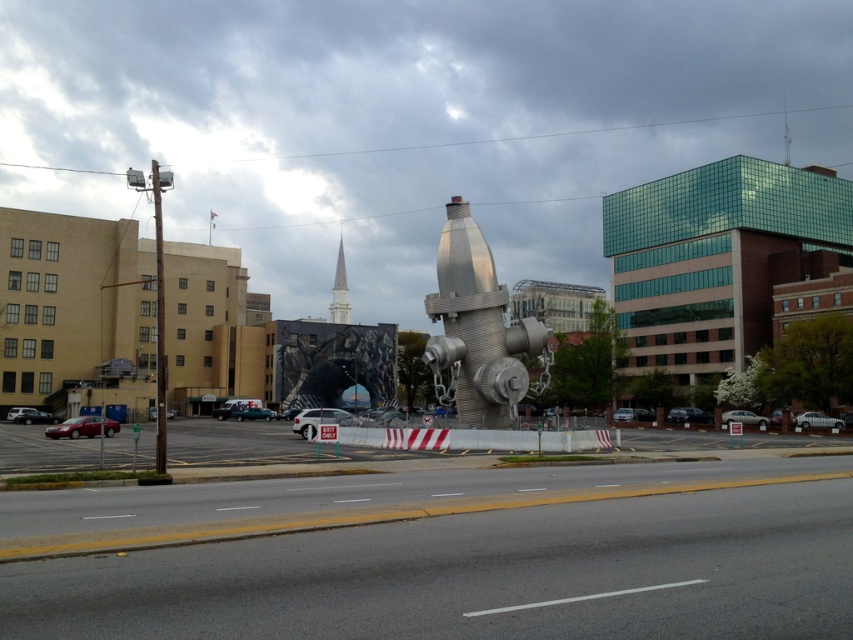
In the scene shown: You are a city planner assessing the road layout. The road has a yellow dividing line. Considering the positions of the brushed metal fire hydrant at center and the silver metallic spire at upper center, which object is wider?

The brushed metal fire hydrant at center is less wide than the silver metallic spire at upper center, so the silver metallic spire at upper center is wider.